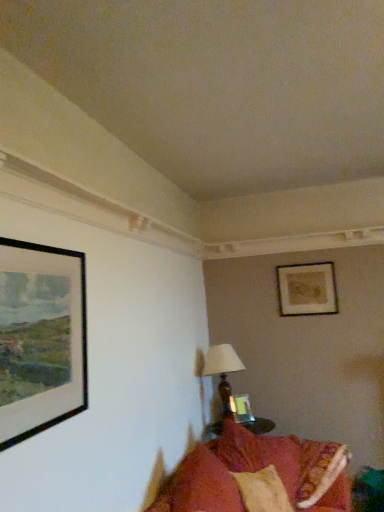
Question: Considering the positions of point (228, 371) and point (233, 461), is point (228, 371) closer or farther from the camera than point (233, 461)?

Choices:
 (A) farther
 (B) closer

Answer: (A)

Question: From a real-world perspective, is matte brown table lamp at center physically located above or below velvet red couch at lower right?

Choices:
 (A) below
 (B) above

Answer: (B)

Question: Which of these objects is positioned closest to the matte gold picture frame at upper right, acting as the 3th picture frame starting from the bottom?

Choices:
 (A) black matte picture frame at left, the 3th picture frame viewed from the right
 (B) velvety orange pillow at lower right
 (C) matte brown table lamp at center
 (D) matte glass picture frame at center, the 2th picture frame in the front-to-back sequence
 (E) velvet red couch at lower right

Answer: (C)

Question: Based on their relative distances, which object is nearer to the velvety orange pillow at lower right?

Choices:
 (A) matte glass picture frame at center, the 2th picture frame in the front-to-back sequence
 (B) velvet red couch at lower right
 (C) black matte picture frame at left, which appears as the first picture frame when viewed from the front
 (D) matte gold picture frame at upper right, acting as the 3th picture frame starting from the bottom
 (E) matte brown table lamp at center

Answer: (B)